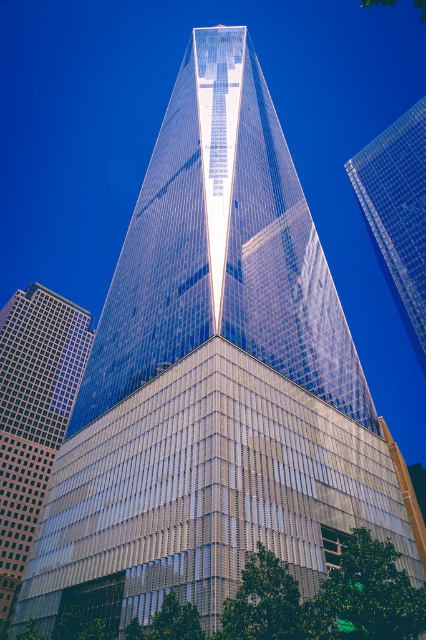
Measure the distance from glassy skyscraper at left to transparent glass skyscraper at upper right.

143.14 meters

Can you confirm if glassy skyscraper at left is bigger than transparent glass skyscraper at upper right?

No.

Identify the location of glassy skyscraper at left. This screenshot has width=426, height=640. (32, 413).